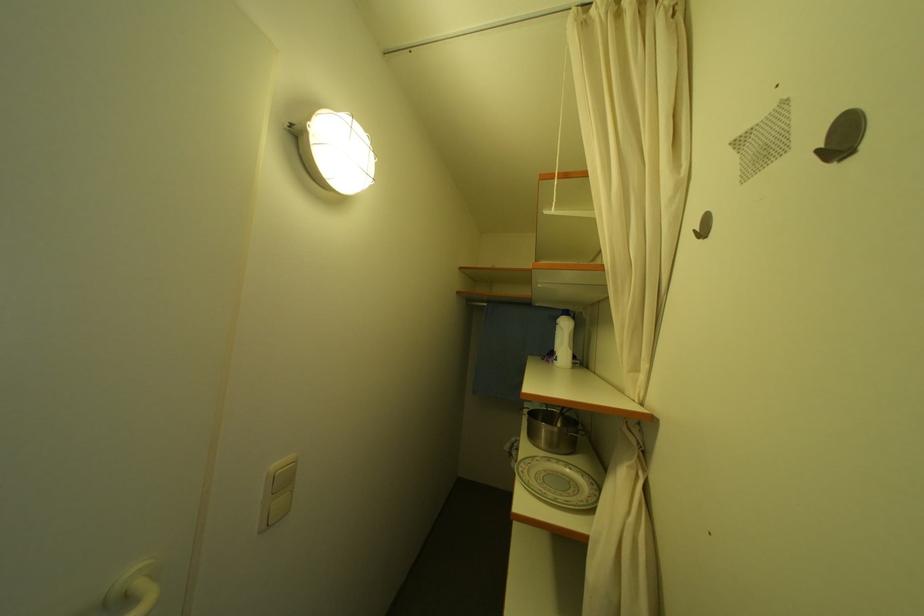
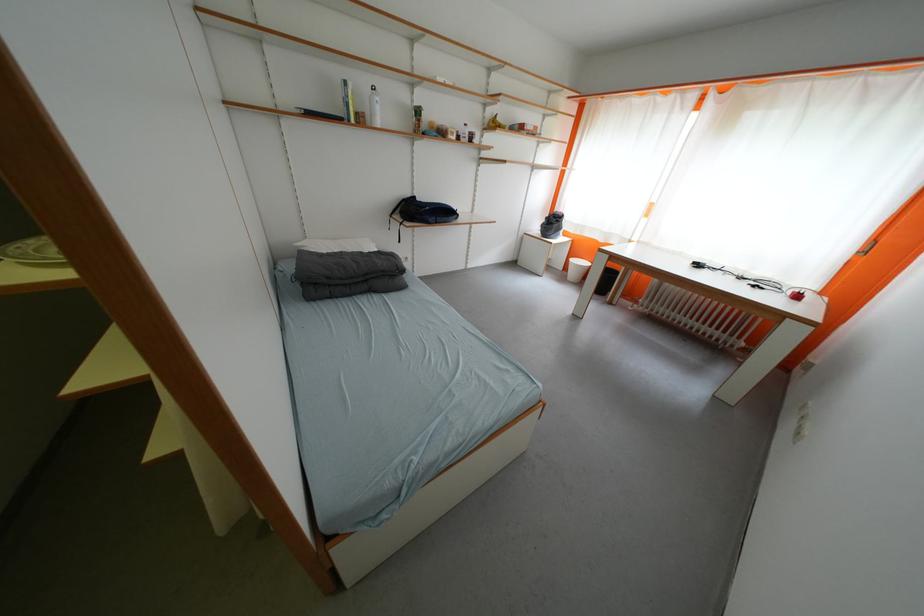
How did the camera likely rotate?

The rotation direction of the camera is right-down.